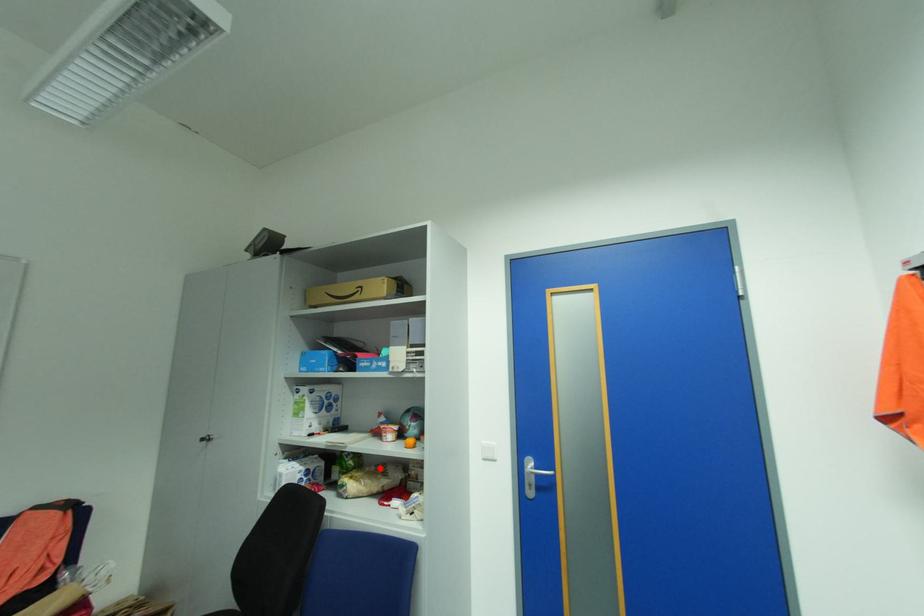
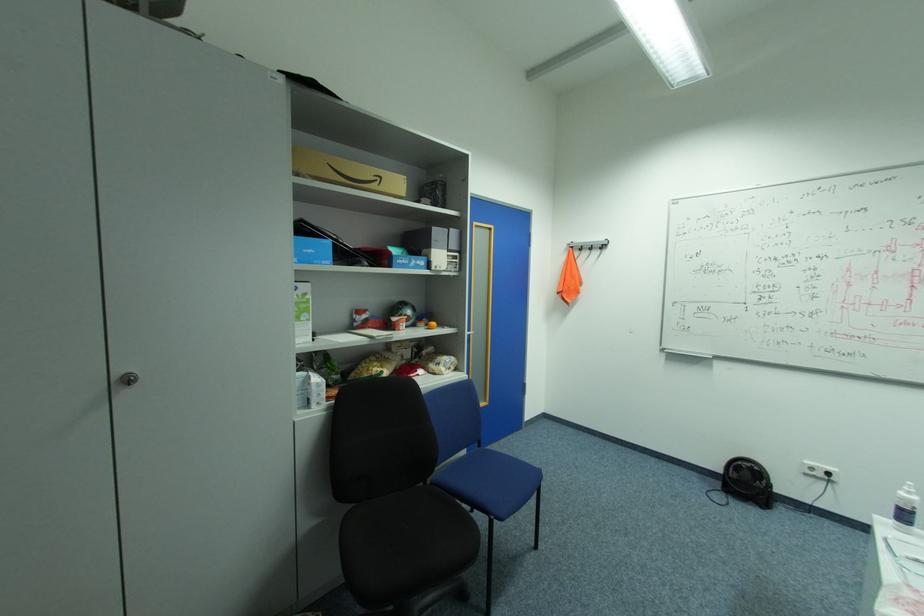
Question: I am providing you with two images of the same scene from different viewpoints. In image1, a red point is highlighted. Considering the same 3D point in image2, which of the following is correct?

Choices:
 (A) It is closer
 (B) It is farther

Answer: (A)